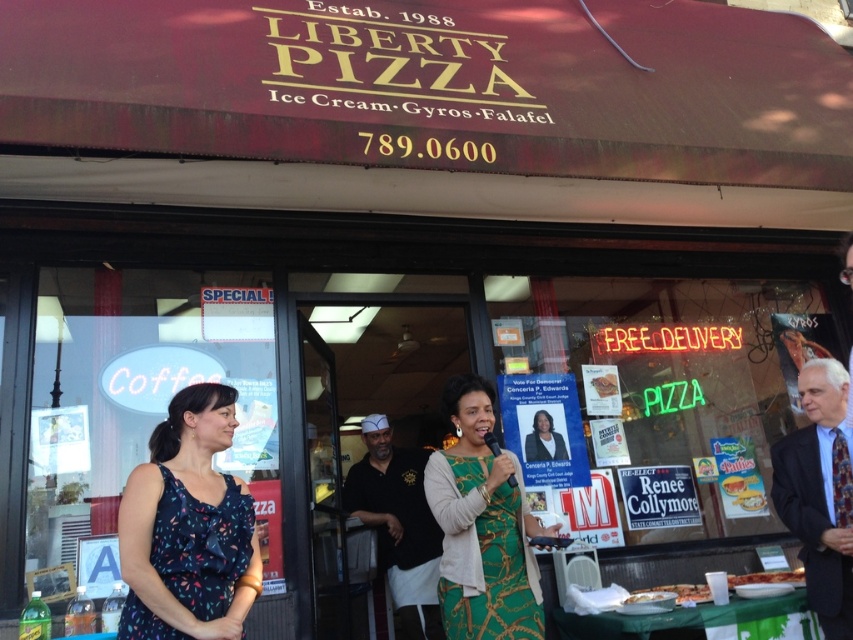
Question: Is dark suit at right closer to the viewer compared to golden crispy pizza slice at lower right?

Choices:
 (A) yes
 (B) no

Answer: (A)

Question: Which point is farther to the camera?

Choices:
 (A) white paper plate at lower center
 (B) black shirt at center
 (C) golden crispy pizza at center

Answer: (B)

Question: Considering the real-world distances, which object is farthest from the green textured dress at center?

Choices:
 (A) black shirt at center
 (B) white paper plate at lower center

Answer: (A)

Question: From the image, what is the correct spatial relationship of dark blue floral dress at center in relation to golden crispy pizza slice at lower right?

Choices:
 (A) left
 (B) right

Answer: (A)

Question: Considering the relative positions of dark blue floral dress at center and golden crispy pizza slice at lower right in the image provided, where is dark blue floral dress at center located with respect to golden crispy pizza slice at lower right?

Choices:
 (A) above
 (B) below

Answer: (A)

Question: Which object is positioned closest to the golden crispy pizza slice at center?

Choices:
 (A) golden crispy pizza slice at lower right
 (B) golden crispy pizza at center

Answer: (B)